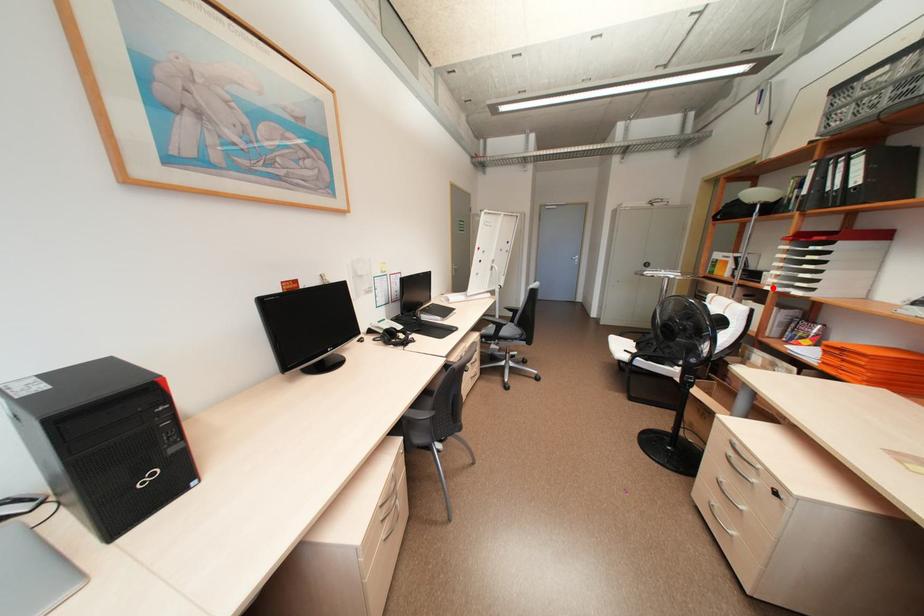
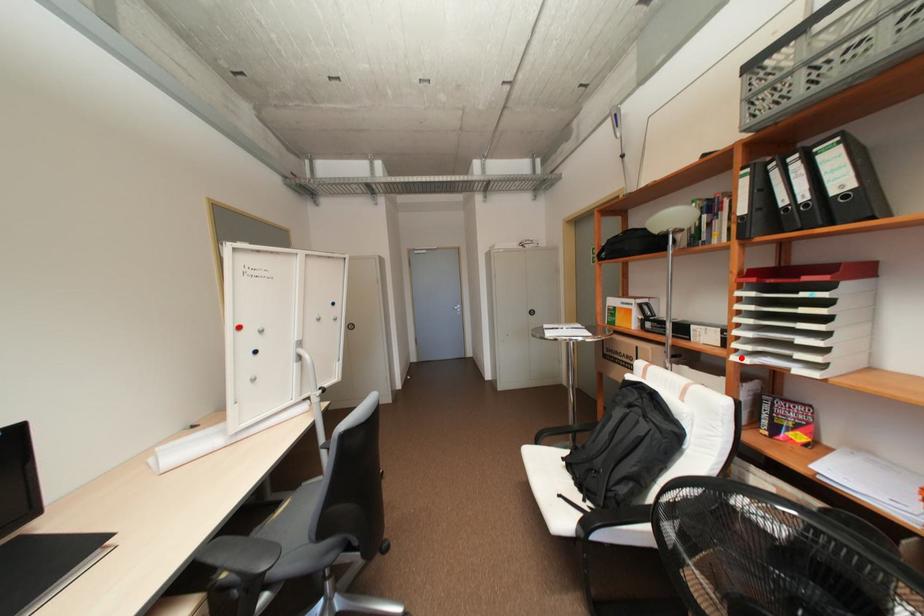
I am providing you with two images of the same scene from different viewpoints. A red point is marked on the first image and another point is marked on the second image. Are the points marked in image1 and image2 representing the same 3D position?

Yes